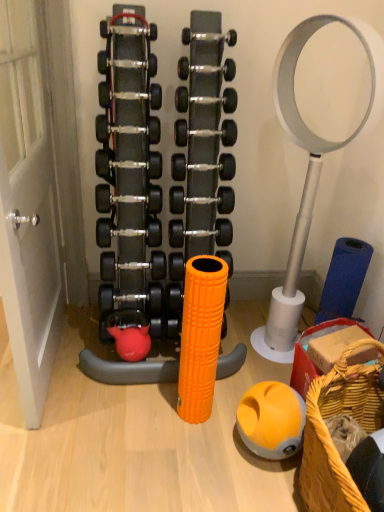
At what (x,y) coordinates should I click in order to perform the action: click on vacant area that lies between orange rubber ball at lower center and orange textured foam roller at center. Please return your answer as a coordinate pair (x, y). This screenshot has height=512, width=384. Looking at the image, I should click on (223, 429).